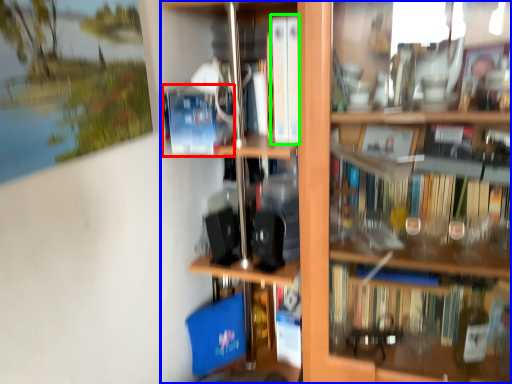
Question: Estimate the real-world distances between objects in this image. Which object is closer to paperback book (highlighted by a red box), shelf (highlighted by a blue box) or book (highlighted by a green box)?

Choices:
 (A) shelf
 (B) book

Answer: (B)